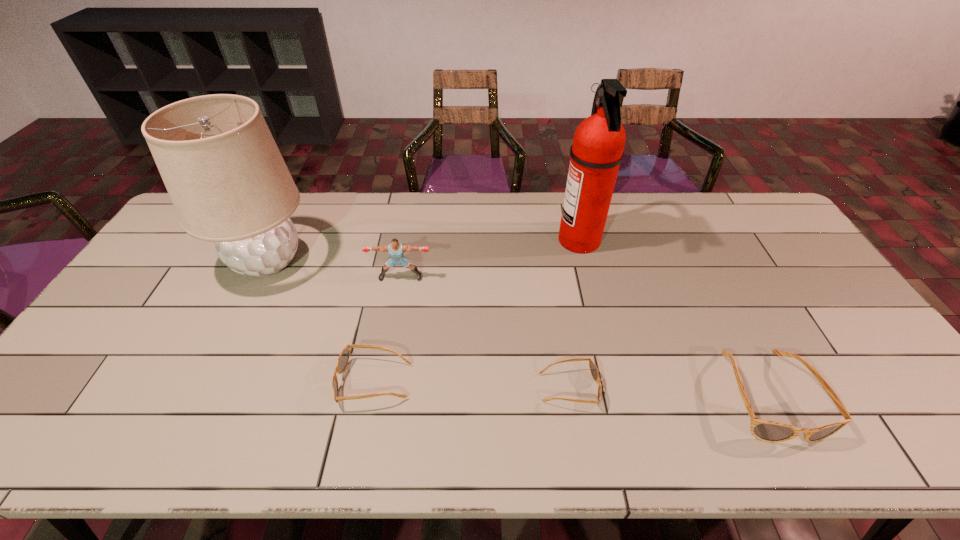
With all sunglassess evenly spaced, where should an extra sunglasses be placed on the left to continue the pattern? Please point out a vacant space. Please provide its 2D coordinates. Your answer should be formatted as a tuple, i.e. [(x, y)], where the tuple contains the x and y coordinates of a point satisfying the conditions above.

[(185, 375)]